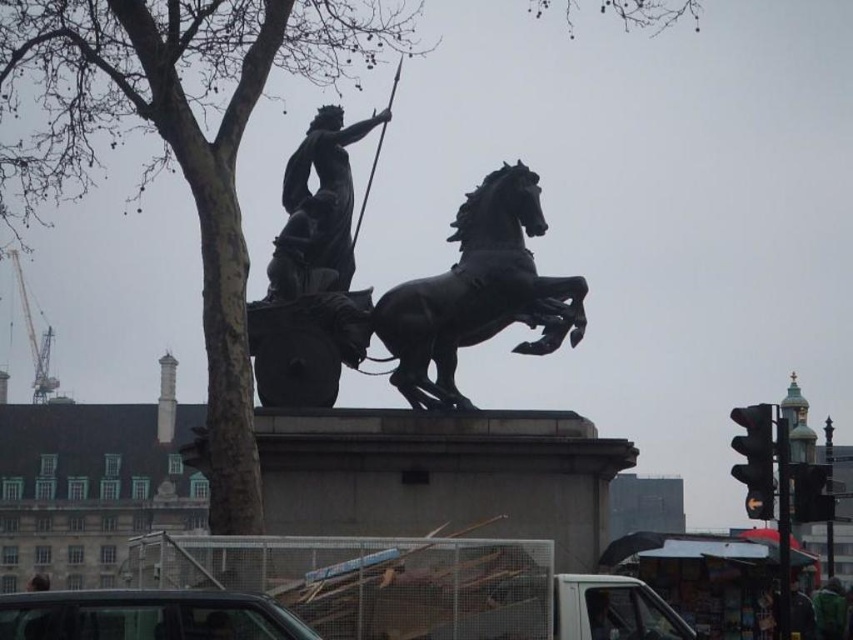
From the picture: Can you confirm if bare wood tree at upper left is positioned above polished bronze horse at center?

Correct, bare wood tree at upper left is located above polished bronze horse at center.

Can you confirm if bare wood tree at upper left is positioned below polished bronze horse at center?

Incorrect, bare wood tree at upper left is not positioned below polished bronze horse at center.

Is point (293, 16) in front of point (482, 300)?

No, (293, 16) is behind (482, 300).

This screenshot has height=640, width=853. In order to click on bare wood tree at upper left in this screenshot , I will do `click(175, 141)`.

Is polished bronze horse at center above bronze statue at center?

No.

Between point (570, 291) and point (291, 228), which one is positioned in front?

Point (570, 291) is in front.

You are a GUI agent. You are given a task and a screenshot of the screen. Output one action in this format:
    pyautogui.click(x=<x>, y=<y>)
    Task: Click on the polished bronze horse at center
    
    Given the screenshot: What is the action you would take?
    pyautogui.click(x=479, y=292)

Can you confirm if bare wood tree at upper left is shorter than bronze statue at center?

No.

Which is above, bare wood tree at upper left or bronze statue at center?

bronze statue at center is higher up.

Between point (3, 42) and point (300, 232), which one is positioned in front?

Point (300, 232) is more forward.

Find the location of a particular element. This screenshot has height=640, width=853. bare wood tree at upper left is located at coordinates (175, 141).